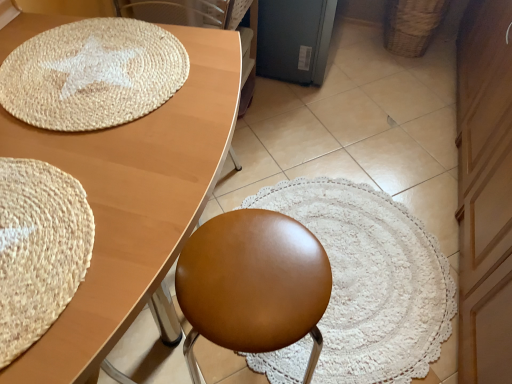
At what (x,y) coordinates should I click in order to perform the action: click on free space that is to the left of woven brown basket at upper right. Please return your answer as a coordinate pair (x, y). This screenshot has width=512, height=384. Looking at the image, I should click on (362, 58).